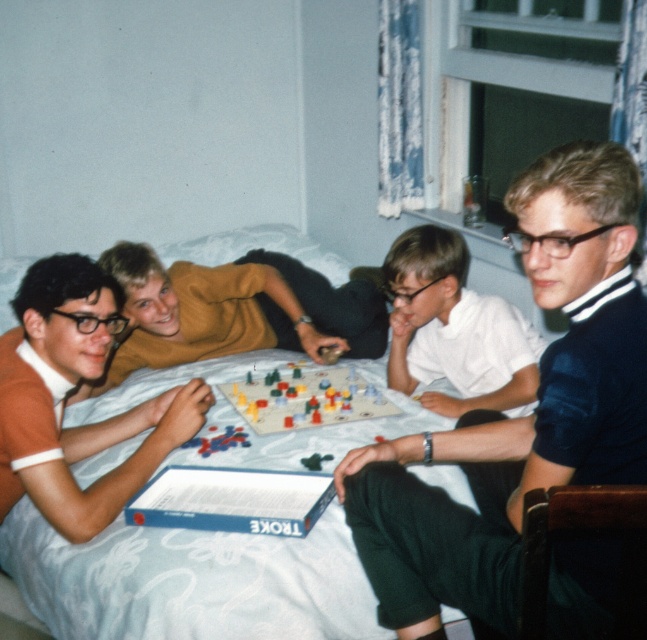
You are a photographer trying to capture a group photo of the matte orange shirt at left and the white matte shirt at center. Since you want both subjects to appear equally sized in the photo, which adjustment should you make?

Since the matte orange shirt at left is much taller than the white matte shirt at center, you should position the camera closer to the white matte shirt at center to make them appear the same size in the photo.

You are a game referee standing at the edge of the table where the board game is being played. You need to reach both the matte yellow shirt at center and the plastic colorful game pieces at center to check their positions. Can you comfortably reach both without moving your position?

The matte yellow shirt at center and plastic colorful game pieces at center are 11.26 inches apart. Since the distance between them is manageable, you can comfortably reach both without moving your position.

You are a photographer trying to capture a closeup of the plastic colorful game pieces at center without including the matte yellow shirt at center in the frame. Is this possible given their positions?

The matte yellow shirt at center is further to the viewer than plastic colorful game pieces at center, so the photographer cannot capture a closeup of the plastic colorful game pieces at center without including the matte yellow shirt at center in the frame because the shirt is closer to the camera.